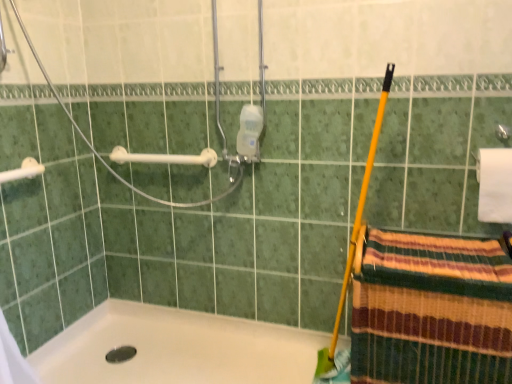
Question: Considering the relative sizes of white glossy bathtub at lower left and striped woven towel at lower right in the image provided, is white glossy bathtub at lower left smaller than striped woven towel at lower right?

Choices:
 (A) no
 (B) yes

Answer: (B)

Question: Could you tell me if white glossy bathtub at lower left is facing striped woven towel at lower right?

Choices:
 (A) no
 (B) yes

Answer: (A)

Question: Does white glossy bathtub at lower left contain striped woven towel at lower right?

Choices:
 (A) no
 (B) yes

Answer: (A)

Question: From the image's perspective, is white glossy bathtub at lower left below striped woven towel at lower right?

Choices:
 (A) yes
 (B) no

Answer: (A)

Question: Is white glossy bathtub at lower left at the right side of striped woven towel at lower right?

Choices:
 (A) no
 (B) yes

Answer: (A)

Question: Is white glossy bathtub at lower left located outside striped woven towel at lower right?

Choices:
 (A) no
 (B) yes

Answer: (B)

Question: Does white plastic towel bar at upper left, the first towel bar viewed from the back, lie in front of striped woven towel at lower right?

Choices:
 (A) no
 (B) yes

Answer: (A)

Question: From a real-world perspective, is white plastic towel bar at upper left, the second towel bar viewed from the front, on top of striped woven towel at lower right?

Choices:
 (A) no
 (B) yes

Answer: (B)

Question: Is white plastic towel bar at upper left, the first towel bar viewed from the back, outside of striped woven towel at lower right?

Choices:
 (A) yes
 (B) no

Answer: (A)

Question: From a real-world perspective, is white plastic towel bar at upper left, the second towel bar when ordered from left to right, positioned under striped woven towel at lower right based on gravity?

Choices:
 (A) no
 (B) yes

Answer: (A)

Question: Is white plastic towel bar at upper left, the second towel bar when ordered from left to right, smaller than striped woven towel at lower right?

Choices:
 (A) no
 (B) yes

Answer: (B)

Question: From the image's perspective, would you say white plastic towel bar at upper left, the second towel bar when ordered from left to right, is positioned over striped woven towel at lower right?

Choices:
 (A) no
 (B) yes

Answer: (B)

Question: Is white plastic towel bar at upper left, positioned as the second towel bar in back-to-front order, with striped woven towel at lower right?

Choices:
 (A) yes
 (B) no

Answer: (B)